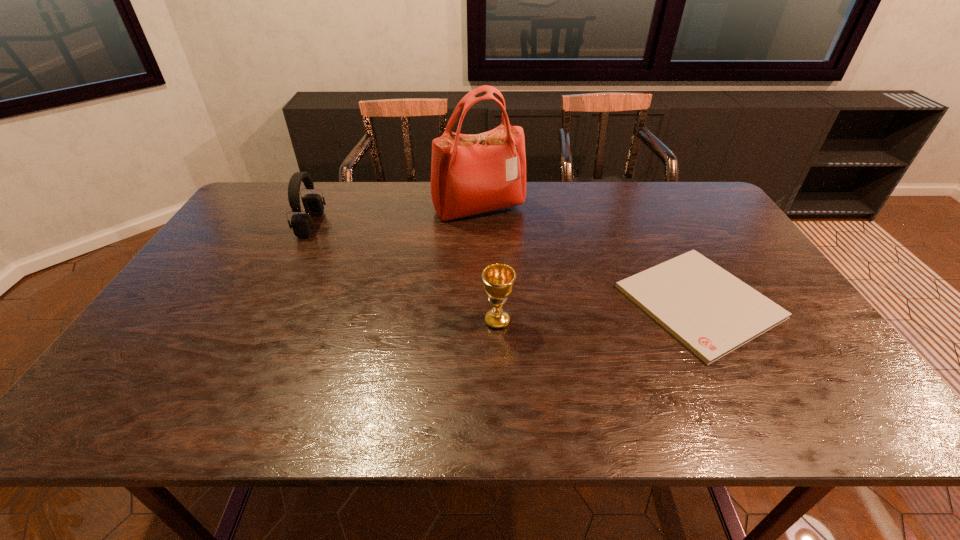
Where is `free area in between the headset and the tallest object`? Image resolution: width=960 pixels, height=540 pixels. free area in between the headset and the tallest object is located at coordinates (395, 217).

You are a GUI agent. You are given a task and a screenshot of the screen. Output one action in this format:
    pyautogui.click(x=<x>, y=<y>)
    Task: Click on the vacant area that lies between the chalice and the leftmost object
    
    Given the screenshot: What is the action you would take?
    pyautogui.click(x=404, y=273)

Locate an element on the screen. Image resolution: width=960 pixels, height=540 pixels. free spot between the tallest object and the headset is located at coordinates (395, 217).

Find the location of `free spot between the handbag and the chalice`. free spot between the handbag and the chalice is located at coordinates (488, 265).

Identify the location of vacant space that is in between the handbag and the leftmost object. (395, 217).

The height and width of the screenshot is (540, 960). I want to click on blank region between the tallest object and the rightmost object, so click(x=588, y=255).

Identify the location of object that is the third nearest to the handbag. (498, 279).

Identify the location of the closest object relative to the chalice. The image size is (960, 540). (712, 312).

This screenshot has width=960, height=540. Find the location of `free space that satisfies the following two spatial constraints: 1. on the headband of the rightmost object; 2. on the right side of the headset`. free space that satisfies the following two spatial constraints: 1. on the headband of the rightmost object; 2. on the right side of the headset is located at coordinates (272, 302).

Image resolution: width=960 pixels, height=540 pixels. In order to click on vacant region that satisfies the following two spatial constraints: 1. on the back side of the chalice; 2. on the headband of the leftmost object in this screenshot , I will do `click(493, 225)`.